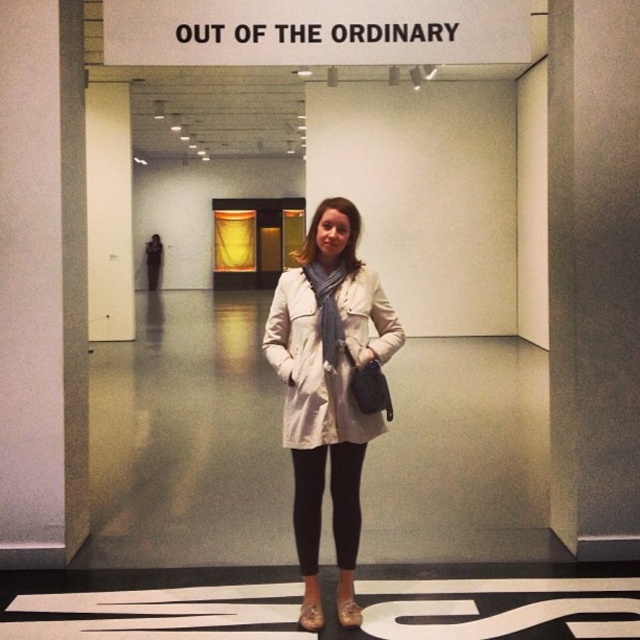
You are an art curator who wants to display two coats in the gallery. The beige fabric coat at center and the matte white coat at center are currently positioned in front of the doorway. According to the scene description, which coat is closer to the viewer, and why?

The beige fabric coat at center is closer to the viewer because the matte white coat at center is positioned behind it, as stated in the scene description.

You are an interior designer observing the scene. You need to decide whether the beige fabric coat at center can be folded and placed inside the black leggings at center without any part of it sticking out. Based on their widths, what would you advise?

The beige fabric coat at center is wider than the black leggings at center, so it cannot be folded and placed inside the black leggings at center without parts sticking out.

You are an artist preparing to display two coats in an exhibition. You have a beige fabric coat at center and a matte white coat at center. Based on the scene, which coat should you place on the higher shelf to ensure proper visibility?

The beige fabric coat at center is taller than the matte white coat at center, so placing the beige fabric coat at center on the higher shelf will ensure proper visibility as it is taller and can be seen over the shelf edge better.